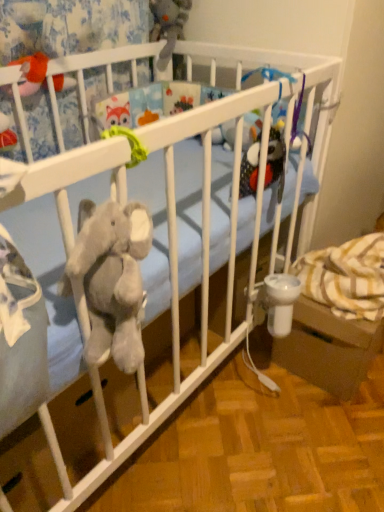
Image resolution: width=384 pixels, height=512 pixels. Describe the element at coordinates (32, 73) in the screenshot. I see `fuzzy orange toy at upper left, which ranks as the 2th toy in right-to-left order` at that location.

Image resolution: width=384 pixels, height=512 pixels. Find the location of `fuzzy orange toy at upper left, the first toy when ordered from left to right`. fuzzy orange toy at upper left, the first toy when ordered from left to right is located at coordinates (32, 73).

In order to face white plastic baby carriage at lower right, should I rotate leftwards or rightwards?

Rotate right and turn 19.097 degrees.

Find the location of a particular element. fuzzy orange toy at upper left, which ranks as the 2th toy in right-to-left order is located at coordinates (32, 73).

Is white plastic baby carriage at lower right oriented away from fuzzy orange toy at upper left, which appears as the 1th toy when ordered from the bottom?

That's not correct — white plastic baby carriage at lower right is not looking away from fuzzy orange toy at upper left, which appears as the 1th toy when ordered from the bottom.

Based on the photo, is white plastic baby carriage at lower right not near fuzzy orange toy at upper left, which ranks as the 1th toy in front-to-back order?

No, white plastic baby carriage at lower right is not far from fuzzy orange toy at upper left, which ranks as the 1th toy in front-to-back order.

From a real-world perspective, is white plastic baby carriage at lower right physically above fuzzy orange toy at upper left, which ranks as the 2th toy in right-to-left order?

No, from a real-world perspective, white plastic baby carriage at lower right is not above fuzzy orange toy at upper left, which ranks as the 2th toy in right-to-left order.

Between white plastic baby carriage at lower right and fuzzy orange toy at upper left, the first toy when ordered from left to right, which one appears on the left side from the viewer's perspective?

fuzzy orange toy at upper left, the first toy when ordered from left to right.

Is fuzzy orange toy at upper left, which ranks as the 1th toy in front-to-back order, at the back of gray plush toy at upper center, which appears as the 1th toy when viewed from the right?

gray plush toy at upper center, which appears as the 1th toy when viewed from the right, does not have its back to fuzzy orange toy at upper left, which ranks as the 1th toy in front-to-back order.

Is gray plush toy at upper center, the first toy when ordered from back to front, far from fuzzy orange toy at upper left, acting as the 2th toy starting from the back?

No, gray plush toy at upper center, the first toy when ordered from back to front, is in close proximity to fuzzy orange toy at upper left, acting as the 2th toy starting from the back.

Between point (166, 62) and point (45, 59), which one is positioned behind?

Point (166, 62)

Between gray plush toy at upper center, which is counted as the first toy, starting from the top, and fuzzy orange toy at upper left, which appears as the 1th toy when ordered from the bottom, which one has smaller width?

Thinner between the two is fuzzy orange toy at upper left, which appears as the 1th toy when ordered from the bottom.

Can you tell me how much white plastic baby carriage at lower right and gray plush toy at upper center, the first toy when ordered from back to front, differ in facing direction?

The angle between the facing direction of white plastic baby carriage at lower right and the facing direction of gray plush toy at upper center, the first toy when ordered from back to front, is 97.8 degrees.

Which object is wider, white plastic baby carriage at lower right or gray plush toy at upper center, which appears as the 1th toy when viewed from the right?

With larger width is white plastic baby carriage at lower right.

How far apart are white plastic baby carriage at lower right and gray plush toy at upper center, which is the second toy from left to right?

They are 38.53 inches apart.

Which object is closer to the camera, white plastic baby carriage at lower right or gray plush toy at upper center, which is the second toy from left to right?

white plastic baby carriage at lower right is in front.

Is fuzzy orange toy at upper left, which appears as the 1th toy when ordered from the bottom, touching white plastic baby carriage at lower right?

There is a gap between fuzzy orange toy at upper left, which appears as the 1th toy when ordered from the bottom, and white plastic baby carriage at lower right.

Is fuzzy orange toy at upper left, acting as the 2th toy starting from the back, not within white plastic baby carriage at lower right?

Absolutely, fuzzy orange toy at upper left, acting as the 2th toy starting from the back, is external to white plastic baby carriage at lower right.

Looking at this image, is fuzzy orange toy at upper left, the first toy when ordered from left to right, shorter than white plastic baby carriage at lower right?

Yes.

Which is more to the left, fuzzy orange toy at upper left, which ranks as the 1th toy in front-to-back order, or white plastic baby carriage at lower right?

fuzzy orange toy at upper left, which ranks as the 1th toy in front-to-back order, is more to the left.

Is gray plush toy at upper center, which is the second toy from left to right, positioned with its back to white plastic baby carriage at lower right?

No.

Between gray plush toy at upper center, which is the second toy from left to right, and white plastic baby carriage at lower right, which one has smaller width?

With smaller width is gray plush toy at upper center, which is the second toy from left to right.

Is there a large distance between gray plush toy at upper center, the 2th toy in the front-to-back sequence, and white plastic baby carriage at lower right?

gray plush toy at upper center, the 2th toy in the front-to-back sequence, is near white plastic baby carriage at lower right, not far away.

The image size is (384, 512). I want to click on toy on the left of gray plush toy at upper center, which ranks as the 2th toy in bottom-to-top order, so [32, 73].

Is fuzzy orange toy at upper left, acting as the 2th toy starting from the back, inside the boundaries of gray plush toy at upper center, which is counted as the first toy, starting from the top, or outside?

fuzzy orange toy at upper left, acting as the 2th toy starting from the back, exists outside the volume of gray plush toy at upper center, which is counted as the first toy, starting from the top.

Does fuzzy orange toy at upper left, which appears as the 1th toy when ordered from the bottom, lie behind gray plush toy at upper center, the first toy when ordered from back to front?

That is False.

Locate an element on the screen. Image resolution: width=384 pixels, height=512 pixels. toy in front of the white plastic baby carriage at lower right is located at coordinates (32, 73).

This screenshot has height=512, width=384. I want to click on toy on the right of fuzzy orange toy at upper left, which appears as the 1th toy when ordered from the bottom, so click(x=168, y=25).

When comparing their distances from gray plush toy at upper center, which appears as the 1th toy when viewed from the right, does fuzzy orange toy at upper left, the first toy when ordered from left to right, or white plastic baby carriage at lower right seem further?

white plastic baby carriage at lower right lies further to gray plush toy at upper center, which appears as the 1th toy when viewed from the right, than the other object.

Based on the photo, from the image, which object appears to be farther from gray plush toy at upper center, which is the second toy from left to right, white plastic baby carriage at lower right or fuzzy orange toy at upper left, acting as the 2th toy starting from the back?

white plastic baby carriage at lower right.

Estimate the real-world distances between objects in this image. Which object is closer to fuzzy orange toy at upper left, which ranks as the 2th toy in right-to-left order, gray plush toy at upper center, which appears as the 1th toy when viewed from the right, or white plastic baby carriage at lower right?

gray plush toy at upper center, which appears as the 1th toy when viewed from the right, is positioned closer to the anchor fuzzy orange toy at upper left, which ranks as the 2th toy in right-to-left order.

From the image, which object appears to be nearer to white plastic baby carriage at lower right, fuzzy orange toy at upper left, which ranks as the 1th toy in front-to-back order, or gray plush toy at upper center, which ranks as the 2th toy in bottom-to-top order?

fuzzy orange toy at upper left, which ranks as the 1th toy in front-to-back order, is positioned closer to the anchor white plastic baby carriage at lower right.

Based on their spatial positions, is white plastic baby carriage at lower right or gray plush toy at upper center, which ranks as the 2th toy in bottom-to-top order, closer to fuzzy orange toy at upper left, which appears as the 1th toy when ordered from the bottom?

gray plush toy at upper center, which ranks as the 2th toy in bottom-to-top order, is positioned closer to the anchor fuzzy orange toy at upper left, which appears as the 1th toy when ordered from the bottom.

In the scene shown: Estimate the real-world distances between objects in this image. Which object is further from white plastic baby carriage at lower right, gray plush toy at upper center, which is the second toy from left to right, or fuzzy orange toy at upper left, which is the second toy from top to bottom?

gray plush toy at upper center, which is the second toy from left to right, is further to white plastic baby carriage at lower right.

Where is `toy between gray plush toy at upper center, the 2th toy in the front-to-back sequence, and white plastic baby carriage at lower right, in the vertical direction`? toy between gray plush toy at upper center, the 2th toy in the front-to-back sequence, and white plastic baby carriage at lower right, in the vertical direction is located at coordinates (32, 73).